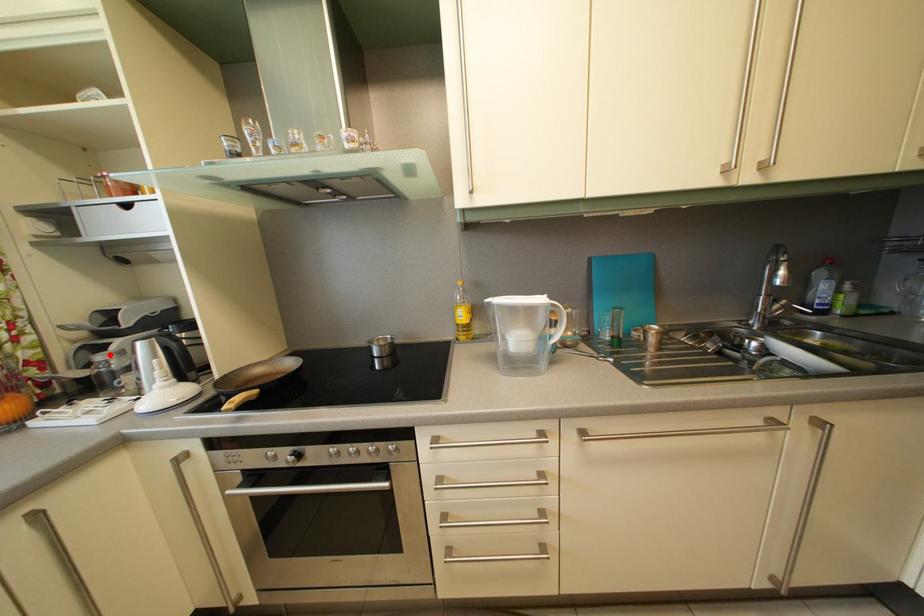
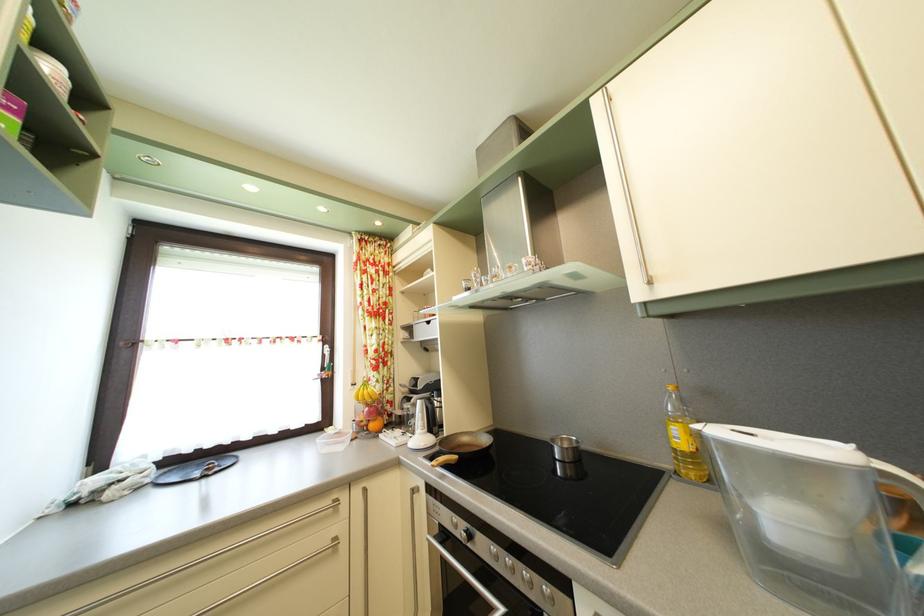
The point at the highlighted location is marked in the first image. Where is the corresponding point in the second image?

(417, 407)